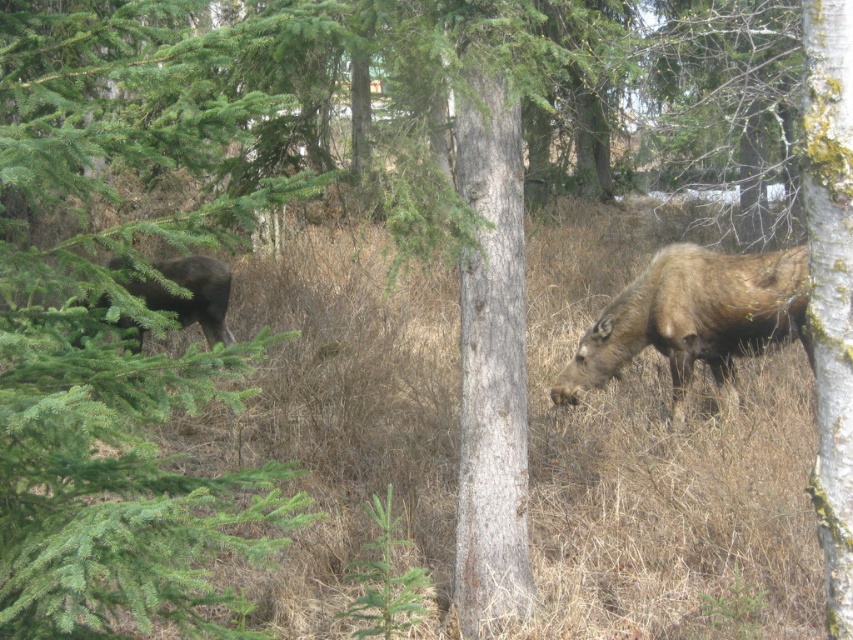
Question: Does brown furry moose at right come in front of dark brown fur at left?

Choices:
 (A) no
 (B) yes

Answer: (B)

Question: Is brown furry moose at right thinner than dark brown fur at left?

Choices:
 (A) yes
 (B) no

Answer: (B)

Question: Which point is closer to the camera taking this photo?

Choices:
 (A) (697, 308)
 (B) (177, 307)

Answer: (A)

Question: Which object appears farthest from the camera in this image?

Choices:
 (A) brown furry moose at right
 (B) dark brown fur at left

Answer: (B)

Question: Is brown furry moose at right thinner than dark brown fur at left?

Choices:
 (A) yes
 (B) no

Answer: (B)